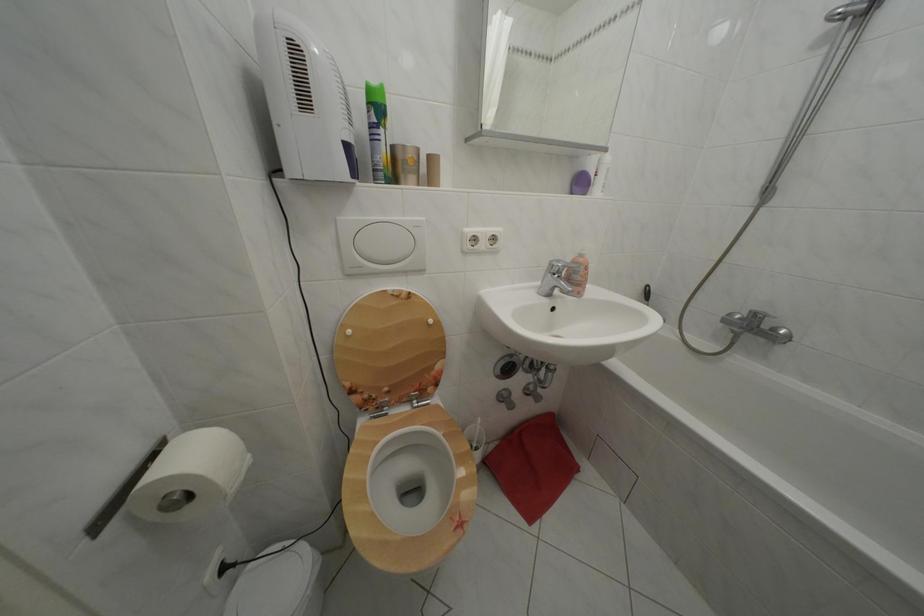
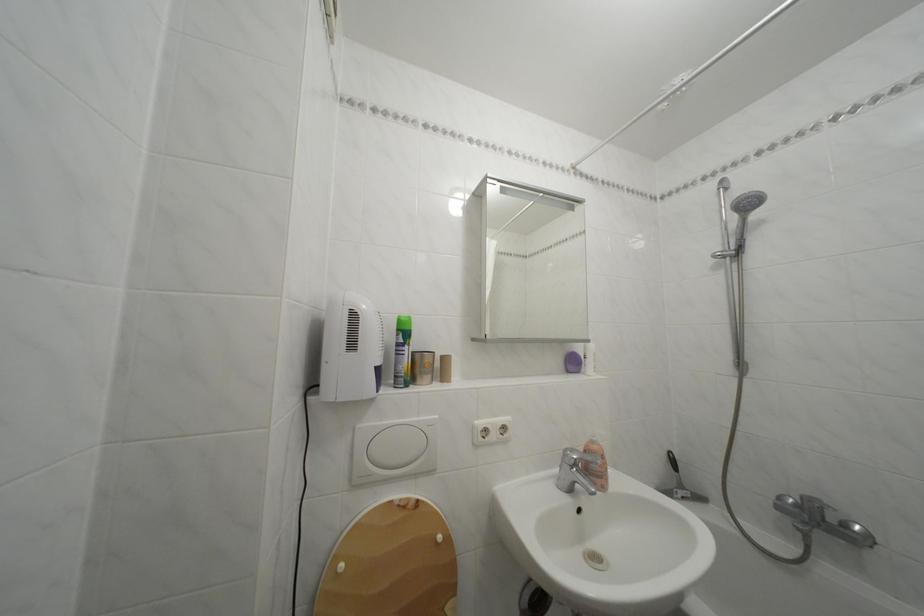
Find the pixel in the second image that matches the point at 567,268 in the first image.

(581, 456)